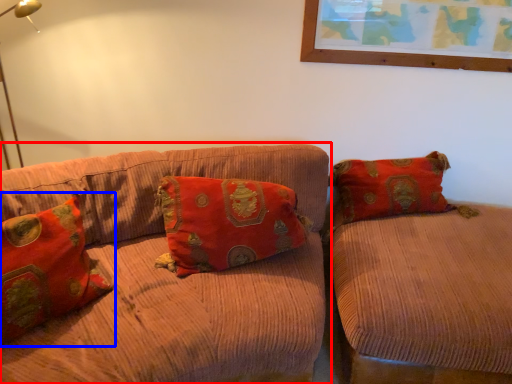
Question: Among these objects, which one is nearest to the camera, studio couch (highlighted by a red box) or pillow (highlighted by a blue box)?

Choices:
 (A) studio couch
 (B) pillow

Answer: (B)